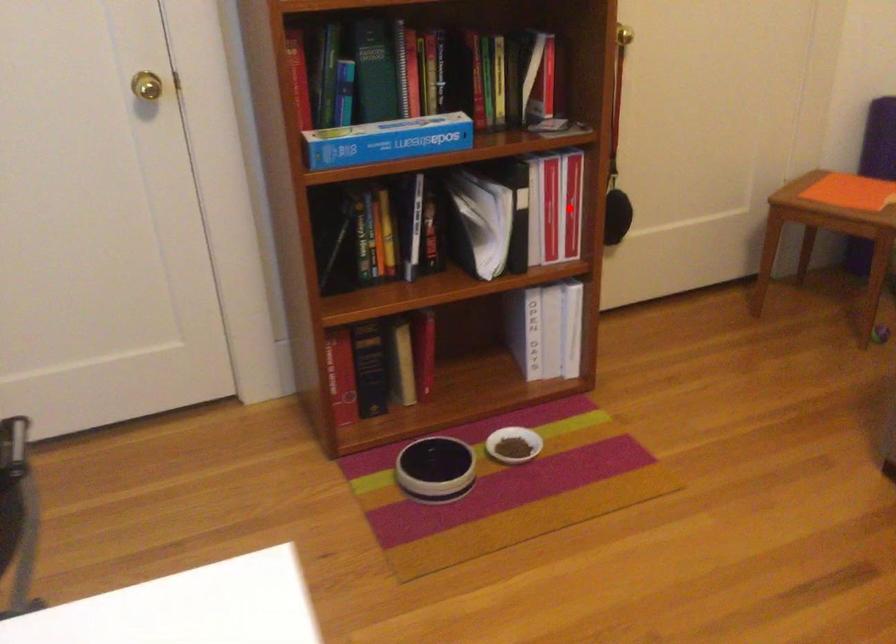
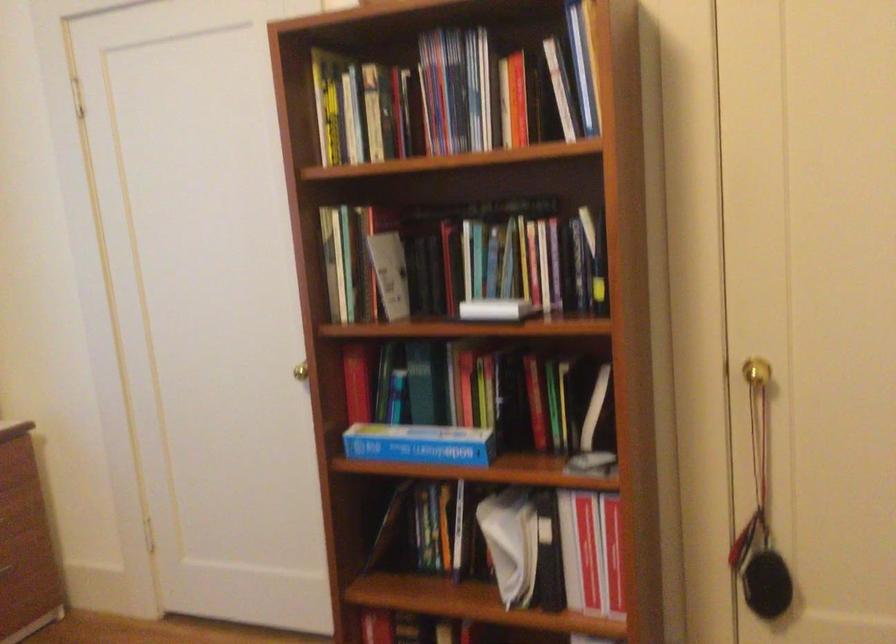
Question: I am providing you with two images of the same scene from different viewpoints. Image1 has a red point marked. In image2, the corresponding 3D location appears at what relative position? Reply with the corresponding letter.

Choices:
 (A) Closer
 (B) Farther

Answer: (A)